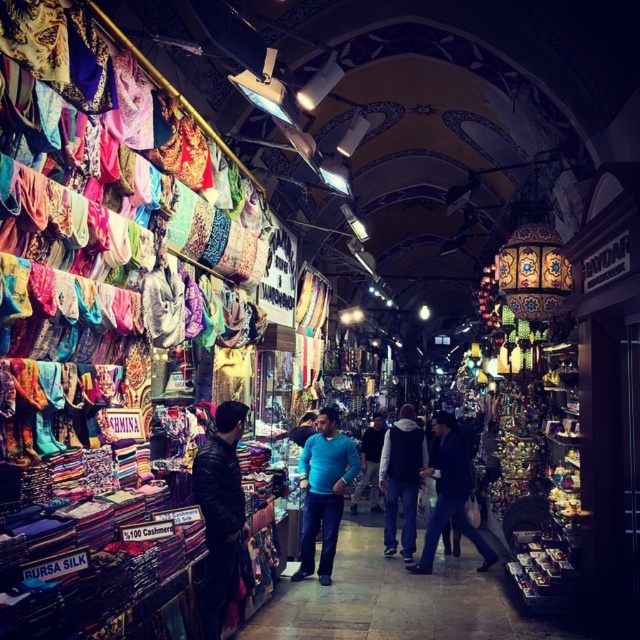
You are a customer in the market looking for clothing items. You see two items at the center of the scene, a matte blue jeans at center and a blue matte shirt at center. Which one is located to the right of the other?

The matte blue jeans at center is positioned on the right side of blue matte shirt at center.

Looking at this image, you are a customer at the market and want to buy both shirts. You notice the blue matte shirt at center and the blue cotton shirt at center. Which one is positioned higher?

The blue matte shirt at center is above the blue cotton shirt at center, so the blue matte shirt at center is positioned higher.

You are navigating through the bustling indoor market and want to reach a specific point. You have two options to choose from, point A at coordinates point A is point (234, 435) and point B is point (374, 456). Which point is closer to you, point A or point B?

Point A at coordinates point (234, 435) is closer to the viewer than point B at coordinates point (374, 456).